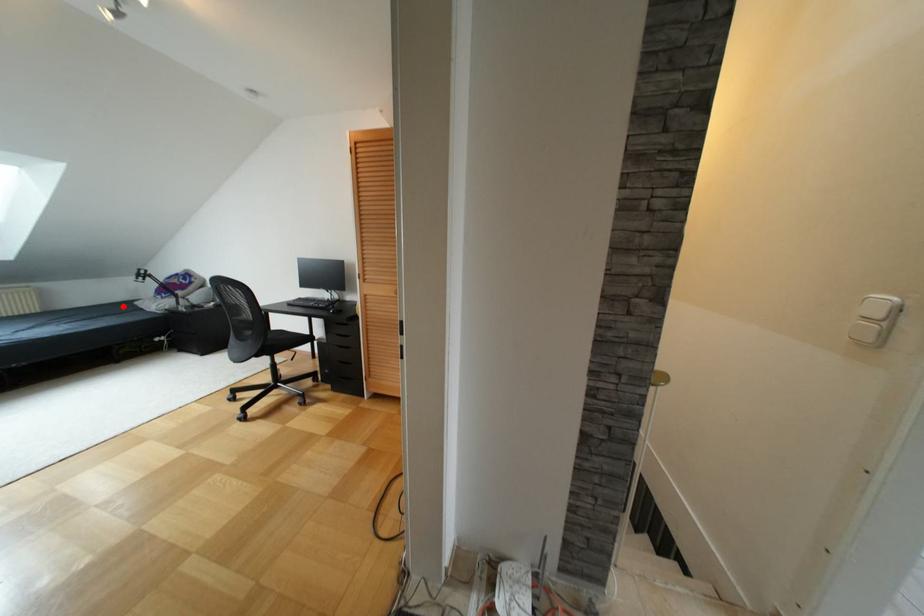
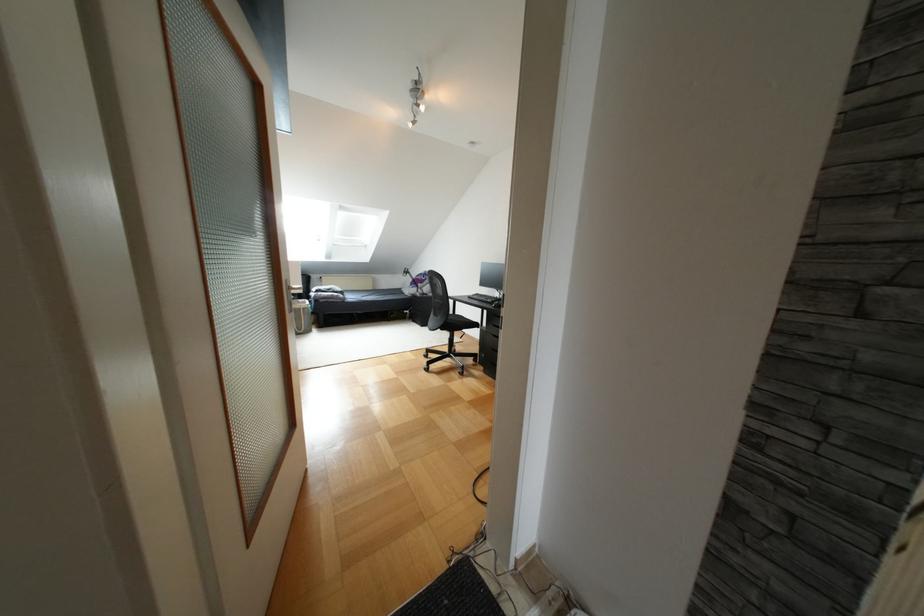
Where in the second image is the point corresponding to the highlighted location from the first image?

(396, 290)